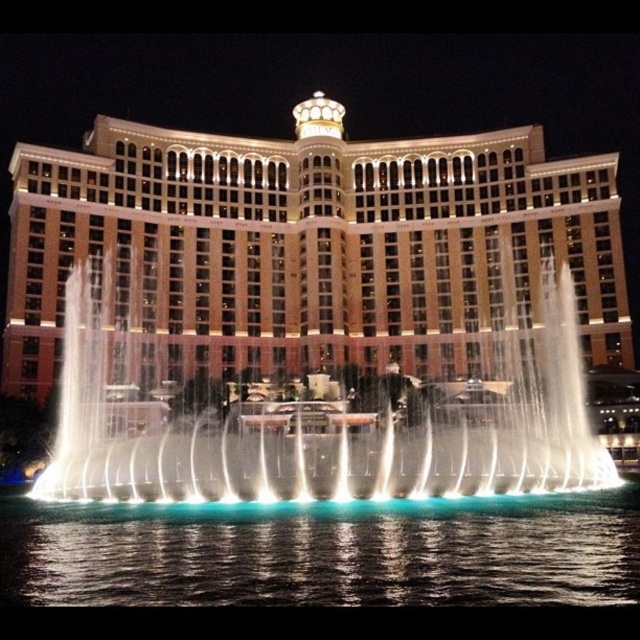
Question: Can you confirm if illuminated tan building at center is positioned to the right of white water at center?

Choices:
 (A) no
 (B) yes

Answer: (A)

Question: Which of the following is the closest to the observer?

Choices:
 (A) blue liquid water at lower center
 (B) white water at center

Answer: (A)

Question: Which is nearer to the illuminated tan building at center?

Choices:
 (A) blue liquid water at lower center
 (B) white water at center

Answer: (B)

Question: Which of these objects is positioned farthest from the illuminated tan building at center?

Choices:
 (A) blue liquid water at lower center
 (B) white water at center

Answer: (A)

Question: Observing the image, what is the correct spatial positioning of illuminated tan building at center in reference to blue liquid water at lower center?

Choices:
 (A) above
 (B) below

Answer: (A)

Question: Is illuminated tan building at center bigger than blue liquid water at lower center?

Choices:
 (A) yes
 (B) no

Answer: (A)